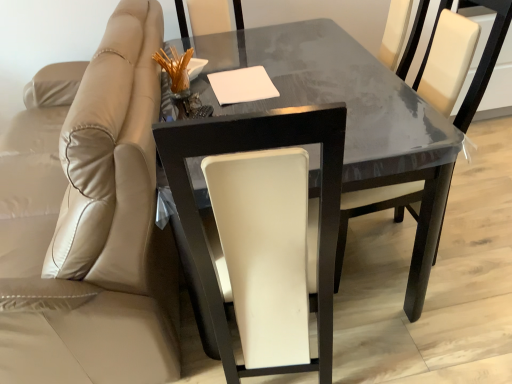
Question: Which direction should I rotate to face white leather chair at center, the third chair when ordered from left to right, — up or down?

Choices:
 (A) down
 (B) up

Answer: (B)

Question: Could you tell me if glossy dark wood table at center is facing white leather chair at center, the third chair when ordered from left to right?

Choices:
 (A) no
 (B) yes

Answer: (B)

Question: Is white leather chair at center, positioned as the first chair in right-to-left order, completely or partially inside glossy dark wood table at center?

Choices:
 (A) yes
 (B) no

Answer: (A)

Question: Does glossy dark wood table at center have a smaller size compared to white leather chair at center, positioned as the first chair in right-to-left order?

Choices:
 (A) no
 (B) yes

Answer: (A)

Question: Considering the relative sizes of glossy dark wood table at center and white leather chair at center, positioned as the first chair in right-to-left order, in the image provided, is glossy dark wood table at center thinner than white leather chair at center, positioned as the first chair in right-to-left order,?

Choices:
 (A) no
 (B) yes

Answer: (A)

Question: Is glossy dark wood table at center to the right of white leather chair at center, the third chair when ordered from left to right, from the viewer's perspective?

Choices:
 (A) no
 (B) yes

Answer: (A)

Question: From the image's perspective, is glossy dark wood table at center located beneath white leather chair at center, the third chair when ordered from left to right?

Choices:
 (A) yes
 (B) no

Answer: (A)

Question: Is white leather chair at center, the third chair when ordered from left to right, at the left side of beige leather chair at left, which is counted as the 1th chair, starting from the left?

Choices:
 (A) no
 (B) yes

Answer: (A)

Question: Is white leather chair at center, the third chair when ordered from left to right, beside beige leather chair at left, which is counted as the 1th chair, starting from the left?

Choices:
 (A) no
 (B) yes

Answer: (A)

Question: Does white leather chair at center, the third chair when ordered from left to right, appear on the right side of beige leather chair at left, which is counted as the 1th chair, starting from the left?

Choices:
 (A) no
 (B) yes

Answer: (B)

Question: From the image's perspective, is white leather chair at center, positioned as the first chair in right-to-left order, located beneath beige leather chair at left, which is counted as the 1th chair, starting from the left?

Choices:
 (A) yes
 (B) no

Answer: (A)

Question: From a real-world perspective, is white leather chair at center, the third chair when ordered from left to right, on top of beige leather chair at left, which is counted as the 1th chair, starting from the left?

Choices:
 (A) yes
 (B) no

Answer: (A)

Question: Is white leather chair at center, positioned as the first chair in right-to-left order, outside beige leather chair at left, which appears as the third chair when viewed from the right?

Choices:
 (A) yes
 (B) no

Answer: (A)

Question: Is beige leather chair at left, which appears as the third chair when viewed from the right, facing towards glossy dark wood table at center?

Choices:
 (A) no
 (B) yes

Answer: (A)